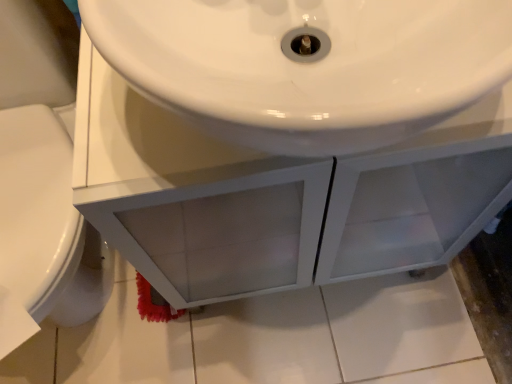
What is the approximate width of white glossy sink at center?

It is 39.90 centimeters.

The image size is (512, 384). Find the location of `white glossy sink at center`. white glossy sink at center is located at coordinates pos(190,197).

Image resolution: width=512 pixels, height=384 pixels. Describe the element at coordinates (190, 197) in the screenshot. I see `white glossy sink at center` at that location.

In order to face white glossy sink at center, should I rotate leftwards or rightwards?

A 5.715 degree turn to the right will do.

Identify the location of white glossy sink at center. Image resolution: width=512 pixels, height=384 pixels. (190, 197).